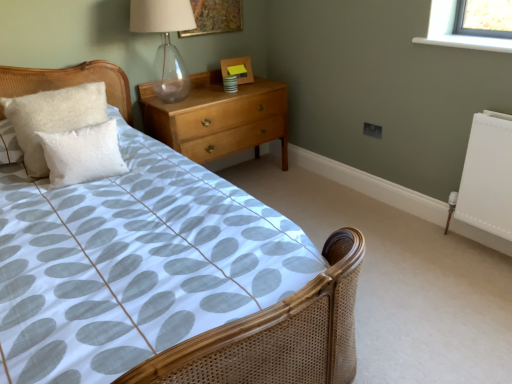
Question: From a real-world perspective, relative to white fluffy pillow at upper left, which is the 2th pillow from front to back, is transparent glass table lamp at upper center vertically above or below?

Choices:
 (A) below
 (B) above

Answer: (B)

Question: In the image, is transparent glass table lamp at upper center positioned in front of or behind white fluffy pillow at upper left, which is the 2th pillow from front to back?

Choices:
 (A) front
 (B) behind

Answer: (B)

Question: Estimate the real-world distances between objects in this image. Which object is farther from the white fluffy pillow at left, the 1th pillow viewed from the front?

Choices:
 (A) white fluffy pillow at upper left, the 1th pillow viewed from the back
 (B) gold textured picture frame at upper center, acting as the first picture frame starting from the top
 (C) woven cane bed at center
 (D) wooden picture frame at upper center, acting as the 1th picture frame starting from the bottom
 (E) light wood/dark finish chest of drawers at upper center

Answer: (D)

Question: Estimate the real-world distances between objects in this image. Which object is closer to the white fluffy pillow at upper left, which is the 2th pillow from front to back?

Choices:
 (A) gold textured picture frame at upper center, positioned as the second picture frame in bottom-to-top order
 (B) woven cane bed at center
 (C) white fluffy pillow at left, the 2th pillow in the back-to-front sequence
 (D) transparent glass table lamp at upper center
 (E) wooden picture frame at upper center, the 2th picture frame viewed from the top

Answer: (C)